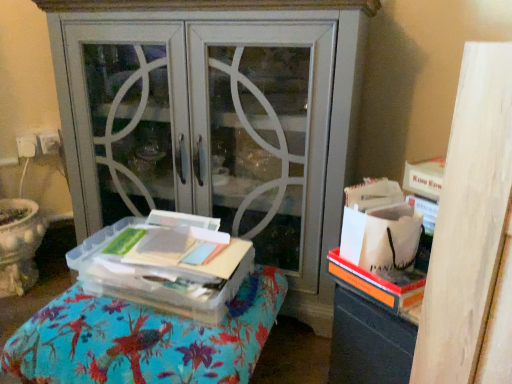
Question: Is clear plastic container at center at the left side of clear plastic container at center?

Choices:
 (A) no
 (B) yes

Answer: (A)

Question: Is the depth of clear plastic container at center greater than that of clear plastic container at center?

Choices:
 (A) yes
 (B) no

Answer: (A)

Question: Considering the relative sizes of clear plastic container at center and clear plastic container at center in the image provided, is clear plastic container at center smaller than clear plastic container at center?

Choices:
 (A) no
 (B) yes

Answer: (B)

Question: Considering the relative sizes of clear plastic container at center and clear plastic container at center in the image provided, is clear plastic container at center wider than clear plastic container at center?

Choices:
 (A) yes
 (B) no

Answer: (B)

Question: Is clear plastic container at center facing towards clear plastic container at center?

Choices:
 (A) no
 (B) yes

Answer: (A)

Question: Is clear plastic container at center turned away from clear plastic container at center?

Choices:
 (A) no
 (B) yes

Answer: (A)

Question: Could clear plastic container at center be considered to be inside clear plastic container at center?

Choices:
 (A) no
 (B) yes

Answer: (A)

Question: From the image's perspective, is clear plastic container at center over clear plastic container at center?

Choices:
 (A) yes
 (B) no

Answer: (B)

Question: Considering the relative positions of clear plastic container at center and clear plastic container at center in the image provided, is clear plastic container at center to the right of clear plastic container at center from the viewer's perspective?

Choices:
 (A) yes
 (B) no

Answer: (B)

Question: Does clear plastic container at center have a greater width compared to clear plastic container at center?

Choices:
 (A) no
 (B) yes

Answer: (B)

Question: Would you say clear plastic container at center is a long distance from clear plastic container at center?

Choices:
 (A) no
 (B) yes

Answer: (A)

Question: Considering the relative sizes of clear plastic container at center and clear plastic container at center in the image provided, is clear plastic container at center shorter than clear plastic container at center?

Choices:
 (A) no
 (B) yes

Answer: (A)

Question: Does matte gray cabinet at center have a greater height compared to clear plastic container at center?

Choices:
 (A) no
 (B) yes

Answer: (B)